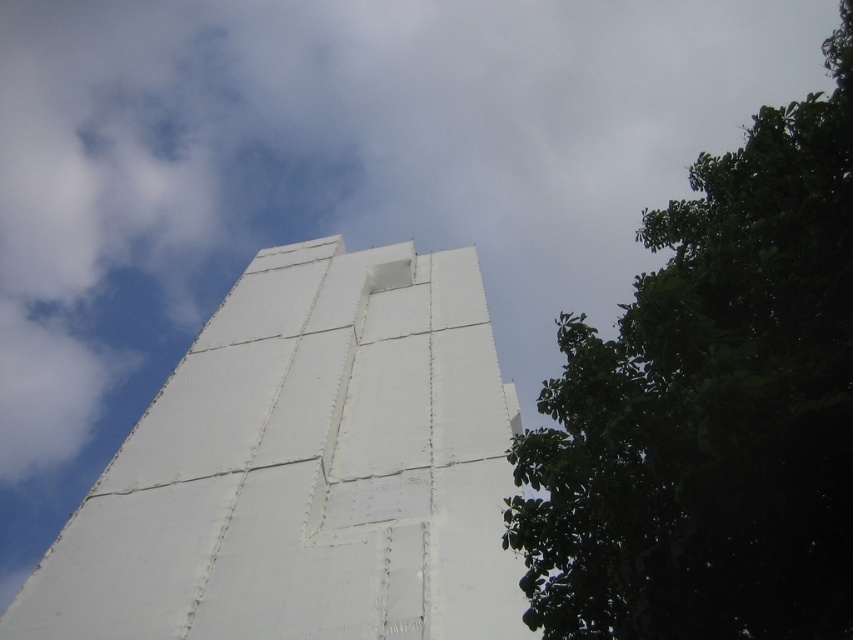
Question: Is white matte tower at center positioned at the back of green leafy tree at lower right?

Choices:
 (A) no
 (B) yes

Answer: (B)

Question: Which point is farther to the camera?

Choices:
 (A) green leafy tree at lower right
 (B) white matte tower at center

Answer: (B)

Question: Which object is farther from the camera taking this photo?

Choices:
 (A) white matte tower at center
 (B) green leafy tree at lower right

Answer: (A)

Question: Can you confirm if white matte tower at center is smaller than green leafy tree at lower right?

Choices:
 (A) no
 (B) yes

Answer: (B)

Question: Is white matte tower at center above green leafy tree at lower right?

Choices:
 (A) yes
 (B) no

Answer: (B)